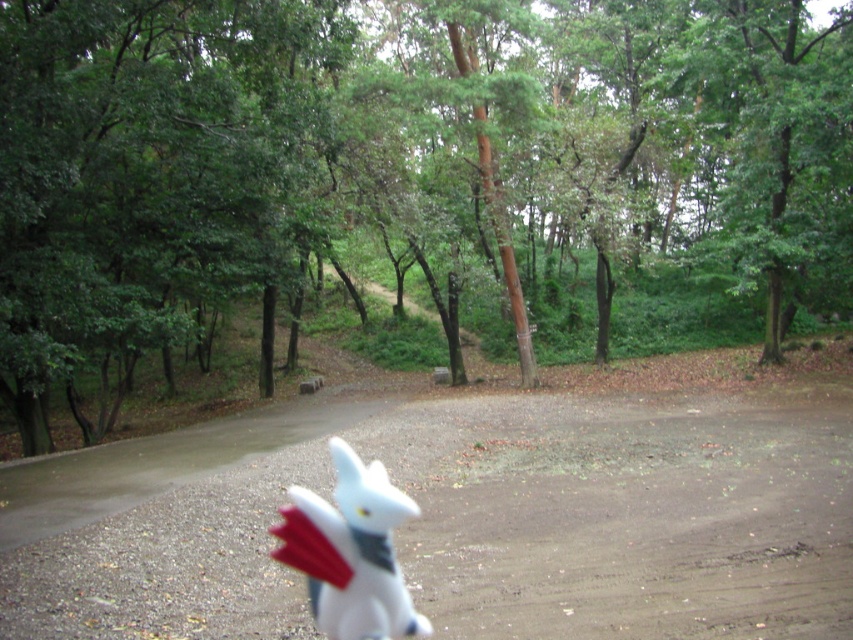
Does brown dirt track at center have a greater height compared to white matte plush toy at center?

Yes.

You are a GUI agent. You are given a task and a screenshot of the screen. Output one action in this format:
    pyautogui.click(x=<x>, y=<y>)
    Task: Click on the brown dirt track at center
    The height and width of the screenshot is (640, 853).
    Given the screenshot: What is the action you would take?
    pyautogui.click(x=622, y=516)

Is point (294, 604) positioned after point (357, 484)?

No, (294, 604) is in front of (357, 484).

Find the location of a particular element. This screenshot has width=853, height=640. brown dirt track at center is located at coordinates (622, 516).

Does green matte tree at center appear on the left side of white matte plush toy at center?

In fact, green matte tree at center is to the right of white matte plush toy at center.

Which of these two, green matte tree at center or white matte plush toy at center, stands taller?

green matte tree at center is taller.

Is point (190, 307) farther from camera compared to point (289, 547)?

Yes.

This screenshot has width=853, height=640. In order to click on green matte tree at center in this screenshot , I will do `click(410, 177)`.

Who is more forward, (22, 396) or (270, 563)?

Point (270, 563) is in front.

Is point (303, 3) more distant than point (170, 500)?

Yes, point (303, 3) is farther from viewer.

The height and width of the screenshot is (640, 853). Find the location of `green matte tree at center`. green matte tree at center is located at coordinates (410, 177).